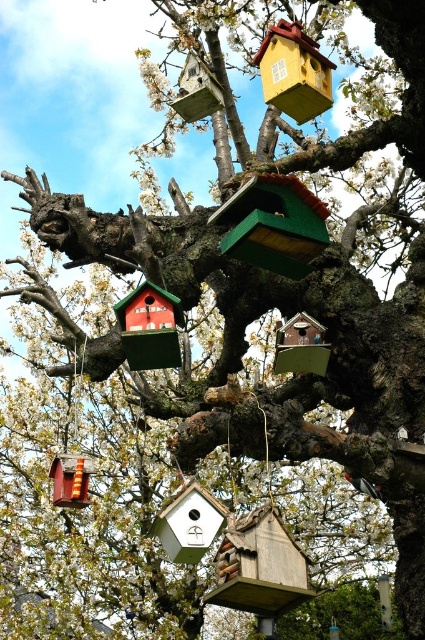
Question: Which point appears farthest from the camera in this image?

Choices:
 (A) (306, 317)
 (B) (70, 497)
 (C) (317, 211)

Answer: (B)

Question: Can you confirm if yellow matte birdhouse at upper center is positioned to the right of white matte bird feeder at center?

Choices:
 (A) no
 (B) yes

Answer: (B)

Question: Which point is closer to the camera?

Choices:
 (A) (286, 177)
 (B) (314, 81)

Answer: (A)

Question: Can you confirm if green matte bird feeder at center is positioned above yellow matte birdhouse at upper center?

Choices:
 (A) no
 (B) yes

Answer: (A)

Question: Which point is closer to the camera?

Choices:
 (A) green matte bird feeder at center
 (B) white matte bird feeder at center
 (C) wooden bird feeder at lower left

Answer: (A)

Question: Does yellow matte birdhouse at upper center have a greater width compared to wooden bird feeder at lower left?

Choices:
 (A) yes
 (B) no

Answer: (A)